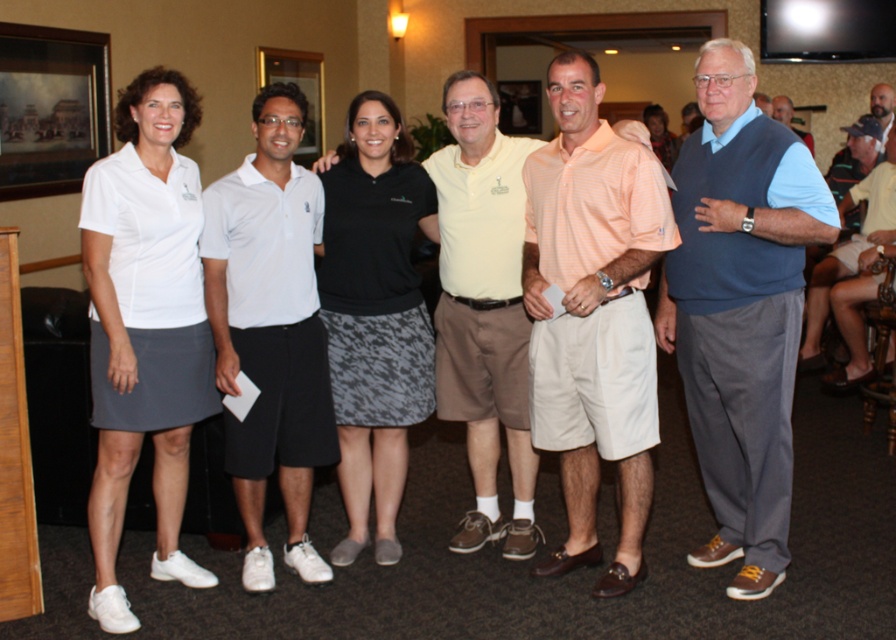
You are a photographer trying to adjust the lighting for a group photo. You notice two skirts in the image, the white matte skirt at left and the matte black skirt at center. Which skirt is positioned lower in the frame?

The white matte skirt at left is positioned below the matte black skirt at center, so it is lower in the frame.

You are standing in the room and want to move from point A to point B. Point A is at coordinate point (444, 310) and point B is at coordinate point (781, 116). Which point is closer to you when you start at point A?

Point A at coordinate point (444, 310) is closer to you than point B at coordinate point (781, 116) because it is the starting point.